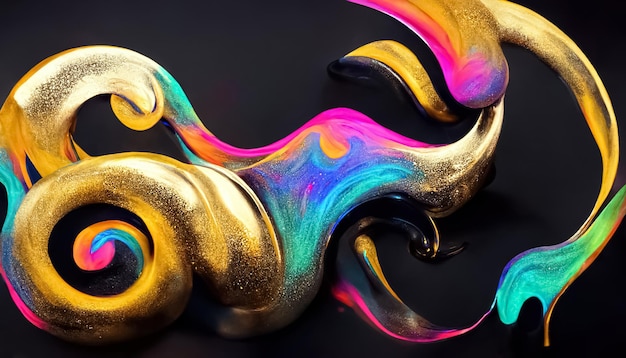
Locate an element on the screen. This screenshot has height=358, width=626. orange paint is located at coordinates (21, 130), (81, 237), (206, 145).